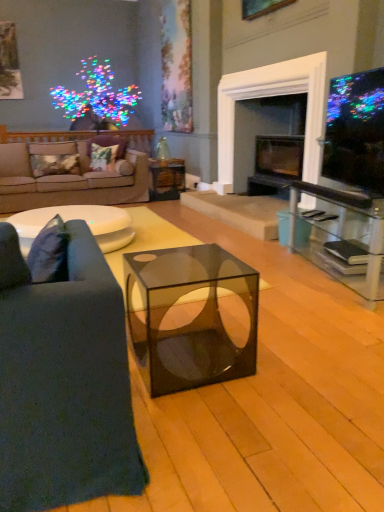
Question: Is dark blue fabric couch at left, the first studio couch from the right, not within metallic gold pillow at left, placed as the first pillow when sorted from left to right?

Choices:
 (A) yes
 (B) no

Answer: (A)

Question: Can you confirm if dark blue fabric couch at left, the 2th studio couch when ordered from left to right, is thinner than metallic gold pillow at left, placed as the first pillow when sorted from left to right?

Choices:
 (A) yes
 (B) no

Answer: (B)

Question: Is dark blue fabric couch at left, the 2th studio couch when ordered from left to right, positioned with its back to metallic gold pillow at left, placed as the first pillow when sorted from left to right?

Choices:
 (A) yes
 (B) no

Answer: (B)

Question: Does dark blue fabric couch at left, marked as the 1th studio couch in a front-to-back arrangement, come in front of metallic gold pillow at left, placed as the 3th pillow when sorted from right to left?

Choices:
 (A) yes
 (B) no

Answer: (A)

Question: From a real-world perspective, is dark blue fabric couch at left, arranged as the 1th studio couch when ordered from the bottom, located beneath metallic gold pillow at left, placed as the 3th pillow when sorted from right to left?

Choices:
 (A) no
 (B) yes

Answer: (B)

Question: Is dark blue fabric couch at left, the first studio couch from the right, situated inside velvet floral pillow at center, which is the second pillow from left to right, or outside?

Choices:
 (A) outside
 (B) inside

Answer: (A)

Question: Looking at their shapes, would you say dark blue fabric couch at left, arranged as the 1th studio couch when ordered from the bottom, is wider or thinner than velvet floral pillow at center, which is the second pillow from left to right?

Choices:
 (A) wide
 (B) thin

Answer: (A)

Question: From the image's perspective, relative to velvet floral pillow at center, positioned as the 2th pillow in right-to-left order, is dark blue fabric couch at left, arranged as the 1th studio couch when ordered from the bottom, above or below?

Choices:
 (A) above
 (B) below

Answer: (B)

Question: Looking at the image, does dark blue fabric couch at left, marked as the 1th studio couch in a front-to-back arrangement, seem bigger or smaller compared to velvet floral pillow at center, positioned as the 2th pillow in right-to-left order?

Choices:
 (A) big
 (B) small

Answer: (A)

Question: From the image's perspective, is black glass fireplace at center located above or below translucent glass cube at center?

Choices:
 (A) above
 (B) below

Answer: (A)

Question: From a real-world perspective, is black glass fireplace at center positioned above or below translucent glass cube at center?

Choices:
 (A) above
 (B) below

Answer: (A)

Question: Relative to translucent glass cube at center, is black glass fireplace at center in front or behind?

Choices:
 (A) behind
 (B) front

Answer: (B)

Question: Is point (281, 104) closer or farther from the camera than point (168, 166)?

Choices:
 (A) closer
 (B) farther

Answer: (B)

Question: Choose the correct answer: Is transparent glass cube at center inside translucent glass cube at center or outside it?

Choices:
 (A) outside
 (B) inside

Answer: (A)

Question: In the image, is transparent glass cube at center positioned in front of or behind translucent glass cube at center?

Choices:
 (A) behind
 (B) front

Answer: (B)